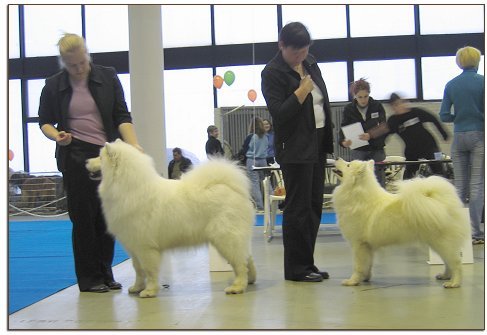
This screenshot has width=487, height=335. I want to click on floor, so click(x=287, y=308).